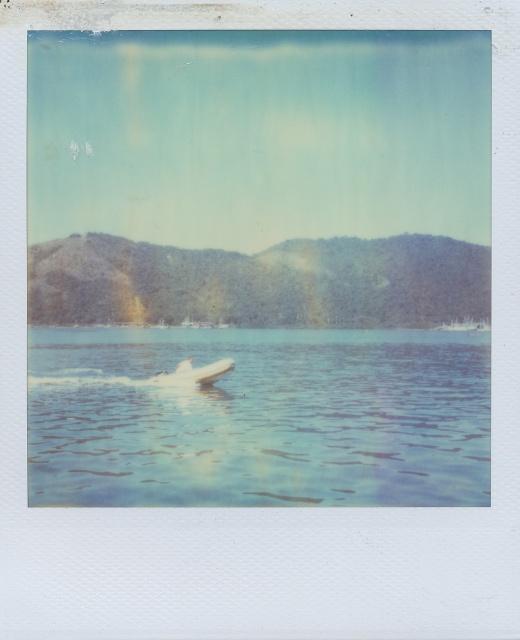
Who is shorter, clear blue water at center or white glossy boat at center?

white glossy boat at center is shorter.

Does clear blue water at center appear on the right side of white glossy boat at center?

Indeed, clear blue water at center is positioned on the right side of white glossy boat at center.

Image resolution: width=520 pixels, height=640 pixels. Find the location of `clear blue water at center`. clear blue water at center is located at coordinates tap(260, 417).

Locate an element on the screen. The width and height of the screenshot is (520, 640). clear blue water at center is located at coordinates (260, 417).